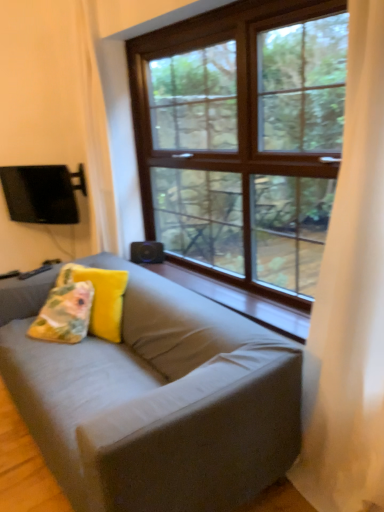
What do you see at coordinates (64, 314) in the screenshot? This screenshot has height=512, width=384. I see `floral fabric pillow at lower left, positioned as the 2th pillow in right-to-left order` at bounding box center [64, 314].

This screenshot has height=512, width=384. Describe the element at coordinates (147, 252) in the screenshot. I see `black matte speaker at center` at that location.

Where is `yellow fabric pillow at center, the first pillow when ordered from right to left`? The width and height of the screenshot is (384, 512). yellow fabric pillow at center, the first pillow when ordered from right to left is located at coordinates (100, 297).

Considering the sizes of objects white sheer curtain at right and brown wood window at center in the image provided, who is wider, white sheer curtain at right or brown wood window at center?

Wider between the two is white sheer curtain at right.

Are white sheer curtain at right and brown wood window at center beside each other?

No, white sheer curtain at right is not in contact with brown wood window at center.

Locate an element on the screen. The image size is (384, 512). curtain that is in front of the brown wood window at center is located at coordinates (350, 300).

Could brown wood window at center be considered to be inside white sheer curtain at right?

No, white sheer curtain at right does not contain brown wood window at center.

From a real-world perspective, is wooden at center physically located above or below black matte speaker at center?

Clearly, from a real-world perspective, wooden at center is below black matte speaker at center.

Is the surface of wooden at center in direct contact with black matte speaker at center?

They are not placed beside each other.

From the picture: Between wooden at center and black matte speaker at center, which one has larger size?

wooden at center is bigger.

Considering the relative positions of wooden at center and black matte speaker at center in the image provided, is wooden at center to the left or to the right of black matte speaker at center?

Clearly, wooden at center is on the right of black matte speaker at center in the image.

Is point (163, 247) farther from viewer compared to point (183, 285)?

Yes, it is behind point (183, 285).

Considering the relative sizes of black matte speaker at center and wooden at center in the image provided, is black matte speaker at center bigger than wooden at center?

Incorrect, black matte speaker at center is not larger than wooden at center.

From the image's perspective, is black matte speaker at center on top of wooden at center?

Yes, from the image's perspective, black matte speaker at center is above wooden at center.

Could you tell me if white sheer curtain at right is turned towards black matte speaker at center?

No, white sheer curtain at right is not aimed at black matte speaker at center.

Which of these two, white sheer curtain at right or black matte speaker at center, is thinner?

black matte speaker at center.

Could black matte speaker at center be considered to be inside white sheer curtain at right?

No, black matte speaker at center is located outside of white sheer curtain at right.

Is matte gray couch at center taller than brown wood window at center?

In fact, matte gray couch at center may be shorter than brown wood window at center.

From the picture: From the image's perspective, which is above, matte gray couch at center or brown wood window at center?

brown wood window at center appears higher in the image.

Is point (87, 408) positioned after point (224, 110)?

That is False.

Can you confirm if matte gray couch at center is bigger than brown wood window at center?

Yes.

How much distance is there between matte gray couch at center and floral fabric pillow at lower left, which ranks as the 1th pillow in left-to-right order?

matte gray couch at center and floral fabric pillow at lower left, which ranks as the 1th pillow in left-to-right order, are 51.28 centimeters apart from each other.

In terms of height, does matte gray couch at center look taller or shorter compared to floral fabric pillow at lower left, which ranks as the 1th pillow in left-to-right order?

matte gray couch at center is taller than floral fabric pillow at lower left, which ranks as the 1th pillow in left-to-right order.

Which of these two, matte gray couch at center or floral fabric pillow at lower left, positioned as the 2th pillow in right-to-left order, is thinner?

floral fabric pillow at lower left, positioned as the 2th pillow in right-to-left order.

Who is smaller, matte gray couch at center or floral fabric pillow at lower left, which ranks as the 1th pillow in left-to-right order?

floral fabric pillow at lower left, which ranks as the 1th pillow in left-to-right order, is smaller.

From the picture: Could you tell me if matte gray couch at center is facing yellow fabric pillow at center, the first pillow when ordered from right to left?

Yes, matte gray couch at center is aimed at yellow fabric pillow at center, the first pillow when ordered from right to left.

Is matte gray couch at center wider than yellow fabric pillow at center, the first pillow when ordered from right to left?

Yes.

In the image, is matte gray couch at center on the left side or the right side of yellow fabric pillow at center, the first pillow when ordered from right to left?

matte gray couch at center is to the right of yellow fabric pillow at center, the first pillow when ordered from right to left.

Consider the image. From the image's perspective, is matte gray couch at center located above or below yellow fabric pillow at center, positioned as the second pillow in left-to-right order?

Clearly, from the image's perspective, matte gray couch at center is below yellow fabric pillow at center, positioned as the second pillow in left-to-right order.

At what (x,y) coordinates should I click in order to perform the action: click on curtain in front of the brown wood window at center. Please return your answer as a coordinate pair (x, y). Looking at the image, I should click on tap(350, 300).

Find the location of a particular element. This screenshot has width=384, height=512. speaker located above the wooden at center (from a real-world perspective) is located at coordinates (147, 252).

Which object lies further to the anchor point black matte speaker at center, white sheer curtain at right or brown wood window at center?

Among the two, white sheer curtain at right is located further to black matte speaker at center.

Estimate the real-world distances between objects in this image. Which object is further from white sheer curtain at right, black matte speaker at center or floral fabric pillow at lower left, positioned as the 2th pillow in right-to-left order?

black matte speaker at center.

Estimate the real-world distances between objects in this image. Which object is further from matte gray couch at center, brown wood window at center or black matte speaker at center?

black matte speaker at center is further to matte gray couch at center.

Looking at the image, which one is located closer to matte gray couch at center, wooden at center or yellow fabric pillow at center, the first pillow when ordered from right to left?

yellow fabric pillow at center, the first pillow when ordered from right to left, lies closer to matte gray couch at center than the other object.

Based on their spatial positions, is matte gray couch at center or brown wood window at center further from floral fabric pillow at lower left, positioned as the 2th pillow in right-to-left order?

The object further to floral fabric pillow at lower left, positioned as the 2th pillow in right-to-left order, is brown wood window at center.

Looking at the image, which one is located further to brown wood window at center, wooden at center or black matte speaker at center?

black matte speaker at center is further to brown wood window at center.

Which object lies further to the anchor point matte gray couch at center, wooden at center or floral fabric pillow at lower left, which ranks as the 1th pillow in left-to-right order?

wooden at center is further to matte gray couch at center.

Considering their positions, is wooden at center positioned further to yellow fabric pillow at center, the first pillow when ordered from right to left, than brown wood window at center?

brown wood window at center lies further to yellow fabric pillow at center, the first pillow when ordered from right to left, than the other object.

Where is `window between floral fabric pillow at lower left, positioned as the 2th pillow in right-to-left order, and white sheer curtain at right from left to right`? The image size is (384, 512). window between floral fabric pillow at lower left, positioned as the 2th pillow in right-to-left order, and white sheer curtain at right from left to right is located at coordinates (245, 134).

Identify the location of pillow located between floral fabric pillow at lower left, positioned as the 2th pillow in right-to-left order, and black matte speaker at center in the depth direction. The image size is (384, 512). tap(100, 297).

The height and width of the screenshot is (512, 384). In order to click on studio couch between white sheer curtain at right and yellow fabric pillow at center, the first pillow when ordered from right to left, from front to back in this screenshot , I will do `click(155, 398)`.

Identify the location of window sill located between matte gray couch at center and black matte speaker at center in the depth direction. This screenshot has height=512, width=384. pos(239,300).